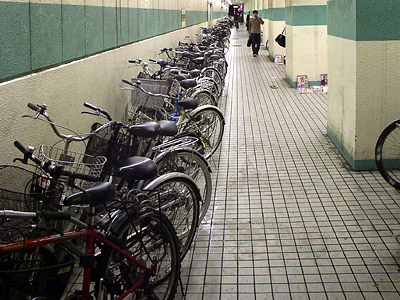
The height and width of the screenshot is (300, 400). I want to click on basket, so click(x=18, y=199), click(x=81, y=166), click(x=50, y=283), click(x=115, y=141), click(x=136, y=110), click(x=152, y=82).